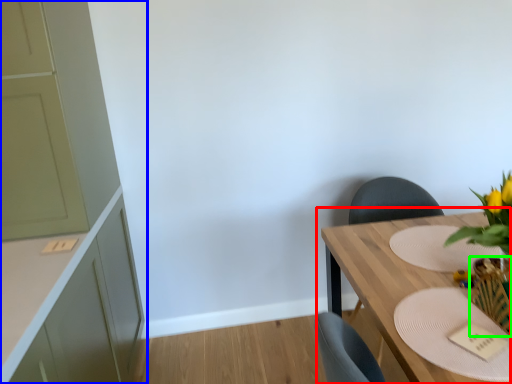
Question: Estimate the real-world distances between objects in this image. Which object is farther from table (highlighted by a red box), cabinetry (highlighted by a blue box) or vase (highlighted by a green box)?

Choices:
 (A) cabinetry
 (B) vase

Answer: (A)